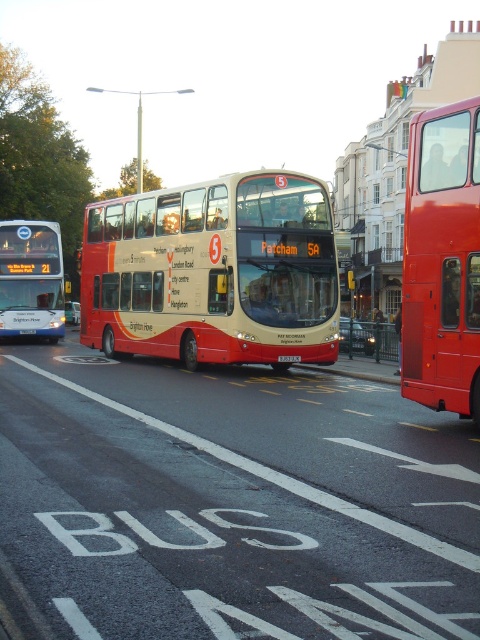
Does point (36, 324) come closer to viewer compared to point (26, 330)?

No, (36, 324) is behind (26, 330).

Can you confirm if matte white bus at left is bigger than white plastic license plate at center?

Indeed, matte white bus at left has a larger size compared to white plastic license plate at center.

Does point (35, 310) lie behind point (29, 333)?

Yes, point (35, 310) is farther from viewer.

Where is `matte white bus at left`? The width and height of the screenshot is (480, 640). matte white bus at left is located at coordinates tap(31, 278).

Does red matte bus at right have a greater width compared to matte white bus at left?

No.

What do you see at coordinates (443, 260) in the screenshot? I see `red matte bus at right` at bounding box center [443, 260].

At what (x,y) coordinates should I click in order to perform the action: click on red matte bus at right. Please return your answer as a coordinate pair (x, y). The width and height of the screenshot is (480, 640). Looking at the image, I should click on (443, 260).

Between beige matte bus at center and black plastic license plate at center, which one is positioned lower?

black plastic license plate at center is below.

Is point (173, 218) positioned in front of point (300, 358)?

No.

Find the location of a particular element. The height and width of the screenshot is (640, 480). beige matte bus at center is located at coordinates (214, 273).